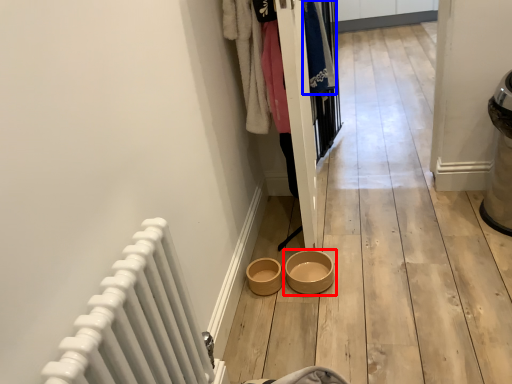
Question: Which object is closer to the camera taking this photo, bowl (highlighted by a red box) or clothing (highlighted by a blue box)?

Choices:
 (A) bowl
 (B) clothing

Answer: (A)